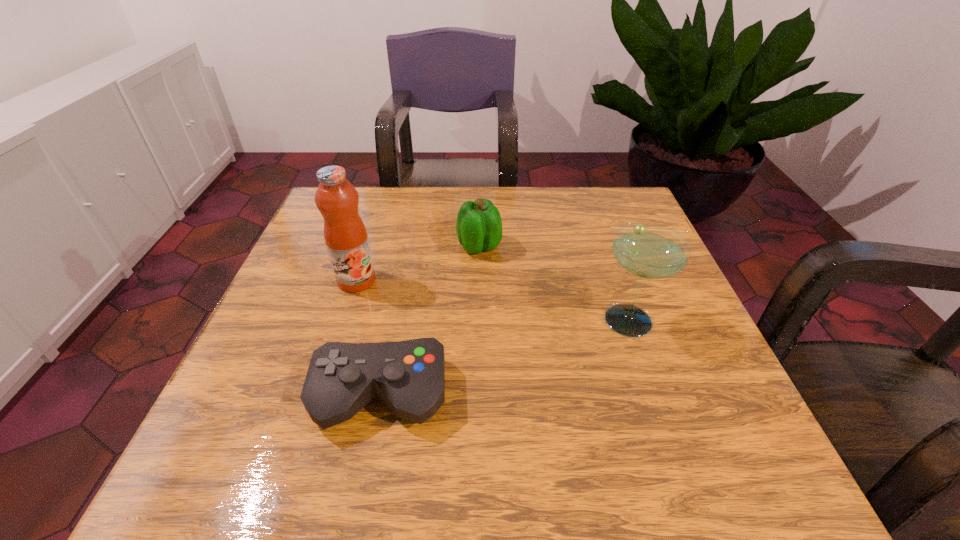
This screenshot has height=540, width=960. In order to click on vacant space that satisfies the following two spatial constraints: 1. on the back side of the nearest object; 2. on the right side of the bell pepper in this screenshot , I will do `click(410, 246)`.

Image resolution: width=960 pixels, height=540 pixels. I want to click on vacant space that satisfies the following two spatial constraints: 1. on the front label of the second farthest object; 2. on the left side of the third shortest object, so click(344, 320).

I want to click on free region that satisfies the following two spatial constraints: 1. on the back side of the nearest object; 2. on the right side of the second object from right to left, so click(x=410, y=246).